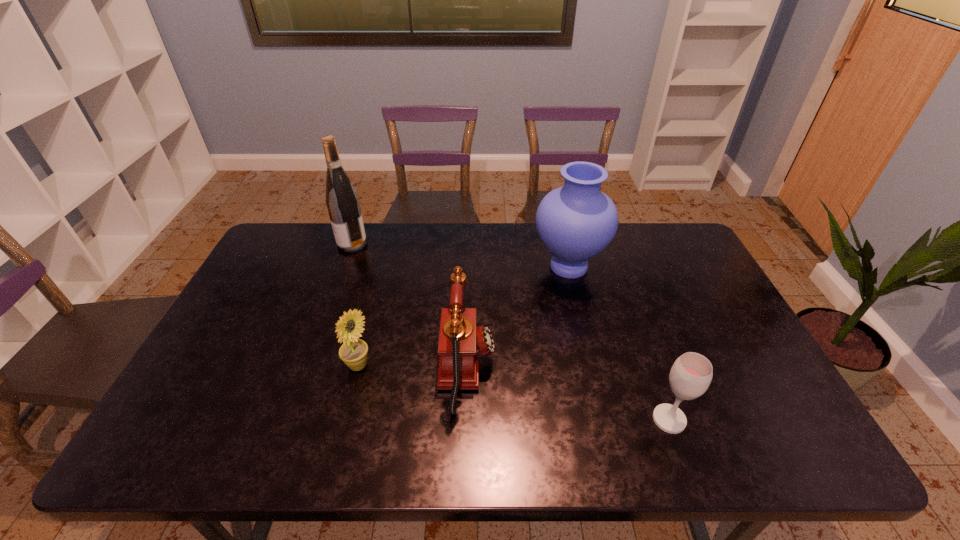
Find the location of `free space between the vase and the wine bottle`. free space between the vase and the wine bottle is located at coordinates (461, 255).

The height and width of the screenshot is (540, 960). I want to click on object that ranks as the fourth closest to the third tallest object, so click(x=342, y=201).

Identify which object is the third closest to the telephone. Please provide its 2D coordinates. Your answer should be formatted as a tuple, i.e. [(x, y)], where the tuple contains the x and y coordinates of a point satisfying the conditions above.

[(690, 376)]

The height and width of the screenshot is (540, 960). In order to click on vacant space that satisfies the following two spatial constraints: 1. on the dial of the wineglass; 2. on the left side of the third object from right to left in this screenshot , I will do `click(466, 420)`.

You are a GUI agent. You are given a task and a screenshot of the screen. Output one action in this format:
    pyautogui.click(x=<x>, y=<y>)
    Task: Click on the blank area in the image that satisfies the following two spatial constraints: 1. on the back side of the wineglass; 2. on the dial of the telephone
    The width and height of the screenshot is (960, 540).
    Given the screenshot: What is the action you would take?
    pyautogui.click(x=651, y=369)

I want to click on vacant area in the image that satisfies the following two spatial constraints: 1. on the dial of the telephone; 2. on the right side of the wineglass, so click(x=466, y=420).